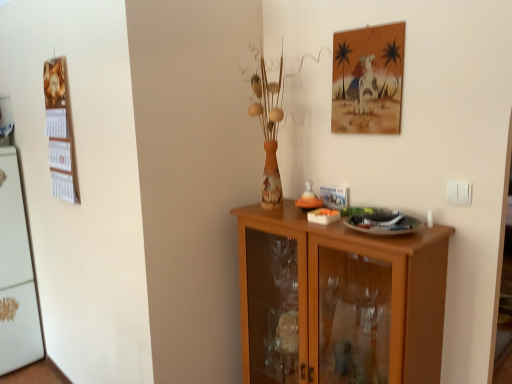
What do you see at coordinates (338, 301) in the screenshot?
I see `light brown wood cabinet at center` at bounding box center [338, 301].

Image resolution: width=512 pixels, height=384 pixels. Identify the location of light brown wood cabinet at center. (338, 301).

Describe the element at coordinates (60, 131) in the screenshot. I see `wooden calendar at left` at that location.

In order to click on white matte refrigerator at left in this screenshot , I will do `click(16, 274)`.

Where is `light brown wood cabinet at center`? This screenshot has height=384, width=512. light brown wood cabinet at center is located at coordinates pos(338,301).

Is point (10, 176) positioned in front of point (63, 174)?

No, it is behind (63, 174).

From a real-world perspective, relative to wooden calendar at left, is white matte refrigerator at left vertically above or below?

In terms of real-world spatial position, white matte refrigerator at left is below wooden calendar at left.

Between white matte refrigerator at left and wooden calendar at left, which one is positioned in front?

wooden calendar at left is in front.

Can you confirm if wooden calendar at left is thinner than white plastic switch at right?

In fact, wooden calendar at left might be wider than white plastic switch at right.

Considering the relative sizes of wooden calendar at left and white plastic switch at right in the image provided, is wooden calendar at left taller than white plastic switch at right?

Correct, wooden calendar at left is much taller as white plastic switch at right.

Can you tell me how much wooden calendar at left and white plastic switch at right differ in facing direction?

0.0048 degrees separate the facing orientations of wooden calendar at left and white plastic switch at right.

Does light brown wood cabinet at center appear on the right side of white matte refrigerator at left?

Yes, light brown wood cabinet at center is to the right of white matte refrigerator at left.

Can we say light brown wood cabinet at center lies outside white matte refrigerator at left?

Yes, light brown wood cabinet at center is not within white matte refrigerator at left.

From a real-world perspective, between light brown wood cabinet at center and white matte refrigerator at left, who is vertically higher?

In real-world perspective, white matte refrigerator at left is above.

From the image's perspective, between light brown wood cabinet at center and wooden calendar at left, who is located below?

light brown wood cabinet at center.

Is light brown wood cabinet at center oriented towards wooden calendar at left?

No, light brown wood cabinet at center is not turned towards wooden calendar at left.

From a real-world perspective, is light brown wood cabinet at center positioned above or below wooden calendar at left?

light brown wood cabinet at center is situated lower than wooden calendar at left in the real world.

Is matte paper picture frame at upper right touching white matte refrigerator at left?

No.

Considering the sizes of matte paper picture frame at upper right and white matte refrigerator at left in the image, is matte paper picture frame at upper right taller or shorter than white matte refrigerator at left?

matte paper picture frame at upper right is shorter than white matte refrigerator at left.

Is matte paper picture frame at upper right positioned beyond the bounds of white matte refrigerator at left?

Indeed, matte paper picture frame at upper right is completely outside white matte refrigerator at left.

Does light brown wood cabinet at center appear on the left side of white plastic switch at right?

Correct, you'll find light brown wood cabinet at center to the left of white plastic switch at right.

Who is bigger, light brown wood cabinet at center or white plastic switch at right?

Bigger between the two is light brown wood cabinet at center.

Which object is further away from the camera taking this photo, light brown wood cabinet at center or white plastic switch at right?

white plastic switch at right is further away from the camera.

Considering the sizes of objects light brown wood cabinet at center and white plastic switch at right in the image provided, who is taller, light brown wood cabinet at center or white plastic switch at right?

light brown wood cabinet at center is taller.

Considering the relative sizes of wooden calendar at left and white matte refrigerator at left in the image provided, is wooden calendar at left smaller than white matte refrigerator at left?

Yes.

Does wooden calendar at left have a lesser height compared to white matte refrigerator at left?

Correct, wooden calendar at left is not as tall as white matte refrigerator at left.

From the picture: Which is nearer, [70,115] or [36,305]?

Point [70,115]

Is wooden calendar at left not within white matte refrigerator at left?

Absolutely, wooden calendar at left is external to white matte refrigerator at left.

Locate an element on the screen. The height and width of the screenshot is (384, 512). bulletin board on the right of white matte refrigerator at left is located at coordinates (60, 131).

Find the location of a particular element. The height and width of the screenshot is (384, 512). bulletin board on the left of the white plastic switch at right is located at coordinates coord(60,131).

When comparing their distances from wooden calendar at left, does white plastic switch at right or matte paper picture frame at upper right seem further?

white plastic switch at right is further to wooden calendar at left.

When comparing their distances from wooden calendar at left, does white plastic switch at right or light brown wood cabinet at center seem further?

The object further to wooden calendar at left is white plastic switch at right.

From the image, which object appears to be farther from light brown wood cabinet at center, white matte refrigerator at left or white plastic switch at right?

Based on the image, white matte refrigerator at left appears to be further to light brown wood cabinet at center.

Considering their positions, is light brown wood cabinet at center positioned further to white plastic switch at right than matte paper picture frame at upper right?

light brown wood cabinet at center is positioned further to the anchor white plastic switch at right.

In the scene shown: Estimate the real-world distances between objects in this image. Which object is further from matte paper picture frame at upper right, light brown wood cabinet at center or white plastic switch at right?

light brown wood cabinet at center lies further to matte paper picture frame at upper right than the other object.

Considering their positions, is white plastic switch at right positioned closer to matte paper picture frame at upper right than light brown wood cabinet at center?

white plastic switch at right is positioned closer to the anchor matte paper picture frame at upper right.

Looking at the image, which one is located further to white plastic switch at right, wooden calendar at left or light brown wood cabinet at center?

wooden calendar at left.

In the scene shown: Estimate the real-world distances between objects in this image. Which object is closer to wooden calendar at left, matte paper picture frame at upper right or white plastic switch at right?

matte paper picture frame at upper right is positioned closer to the anchor wooden calendar at left.

At what (x,y) coordinates should I click in order to perform the action: click on bulletin board situated between white matte refrigerator at left and white plastic switch at right from left to right. Please return your answer as a coordinate pair (x, y). Image resolution: width=512 pixels, height=384 pixels. Looking at the image, I should click on (60, 131).

Where is `electric outlet between matte paper picture frame at upper right and light brown wood cabinet at center in the up-down direction`? The image size is (512, 384). electric outlet between matte paper picture frame at upper right and light brown wood cabinet at center in the up-down direction is located at coordinates (459, 192).

Locate an element on the screen. picture frame between wooden calendar at left and white plastic switch at right in the horizontal direction is located at coordinates (368, 80).

Locate an element on the screen. Image resolution: width=512 pixels, height=384 pixels. bulletin board between white matte refrigerator at left and matte paper picture frame at upper right in the horizontal direction is located at coordinates (60, 131).